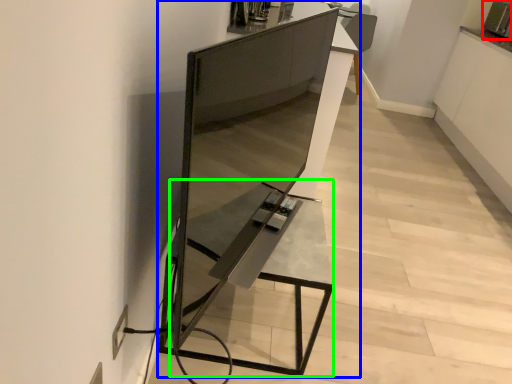
Question: Based on their relative distances, which object is farther from appliance (highlighted by a red box)? Choose from furniture (highlighted by a blue box) and table (highlighted by a green box).

Choices:
 (A) furniture
 (B) table

Answer: (B)